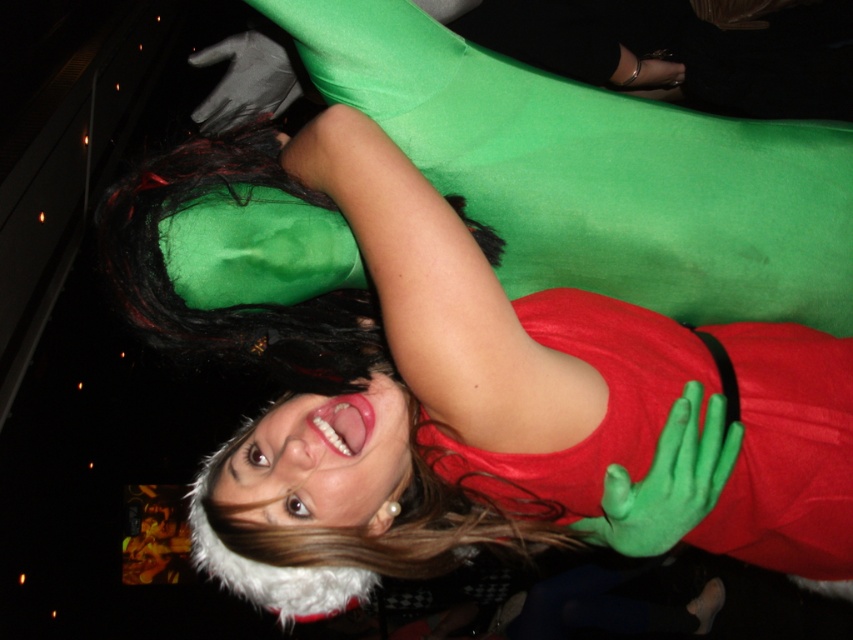
Question: Does matte green gloves at upper center appear on the left side of green matte gloves at upper center?

Choices:
 (A) yes
 (B) no

Answer: (A)

Question: Which point appears farthest from the camera in this image?

Choices:
 (A) tap(827, 556)
 (B) tap(381, 145)

Answer: (A)

Question: Which point appears closest to the camera in this image?

Choices:
 (A) (352, 188)
 (B) (519, 513)

Answer: (A)

Question: Does matte green gloves at upper center come in front of green matte gloves at upper center?

Choices:
 (A) yes
 (B) no

Answer: (A)

Question: Which point is closer to the camera taking this photo?

Choices:
 (A) (761, 412)
 (B) (279, 513)

Answer: (B)

Question: Considering the relative positions of matte green gloves at upper center and green matte gloves at upper center in the image provided, where is matte green gloves at upper center located with respect to green matte gloves at upper center?

Choices:
 (A) below
 (B) above

Answer: (B)